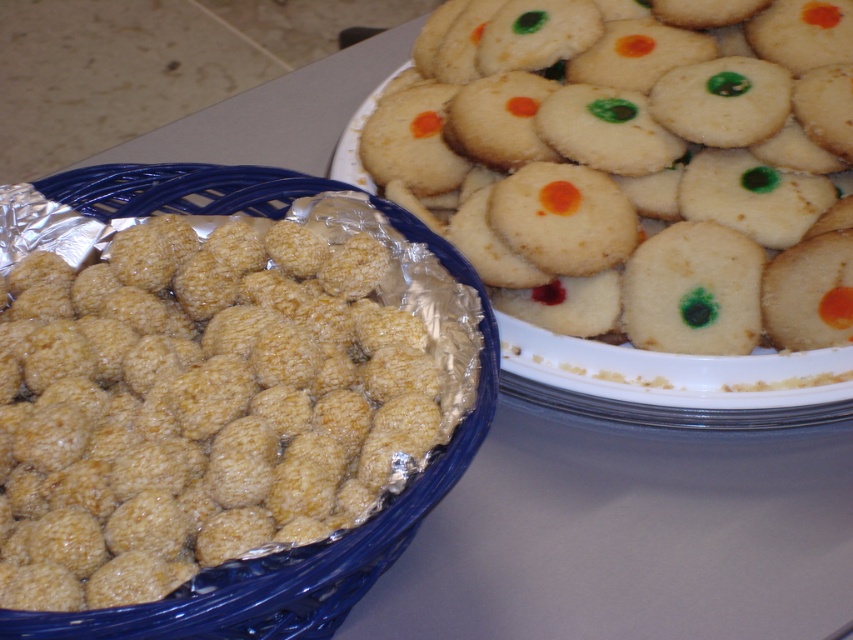
Question: Does golden textured balls at left appear under matte white cookie at upper right?

Choices:
 (A) no
 (B) yes

Answer: (B)

Question: Is golden textured balls at left positioned behind matte white cookie at upper right?

Choices:
 (A) yes
 (B) no

Answer: (B)

Question: Observing the image, what is the correct spatial positioning of golden textured balls at left in reference to matte white cookie at upper right?

Choices:
 (A) left
 (B) right

Answer: (A)

Question: Which point is closer to the camera?

Choices:
 (A) golden textured balls at left
 (B) matte white cookie at upper right

Answer: (A)